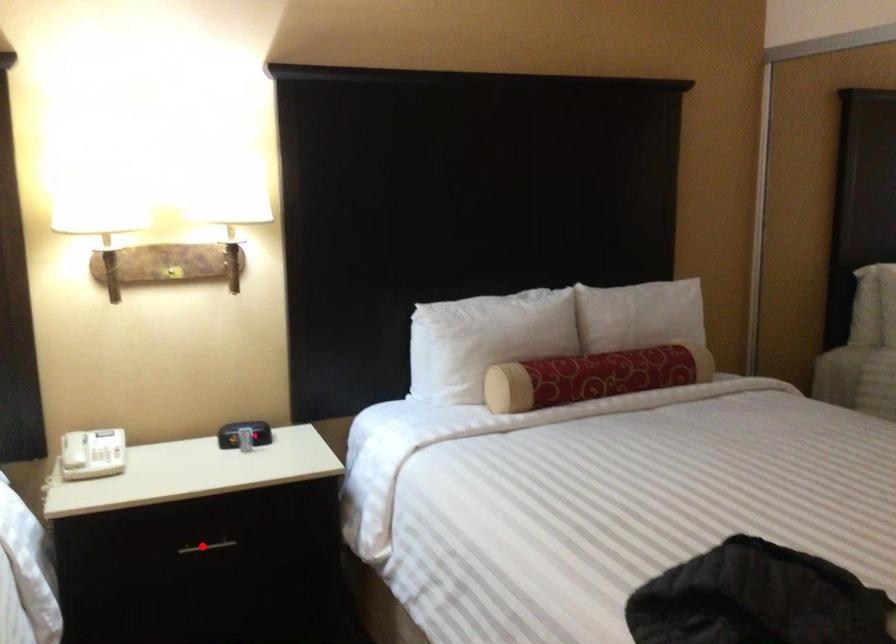
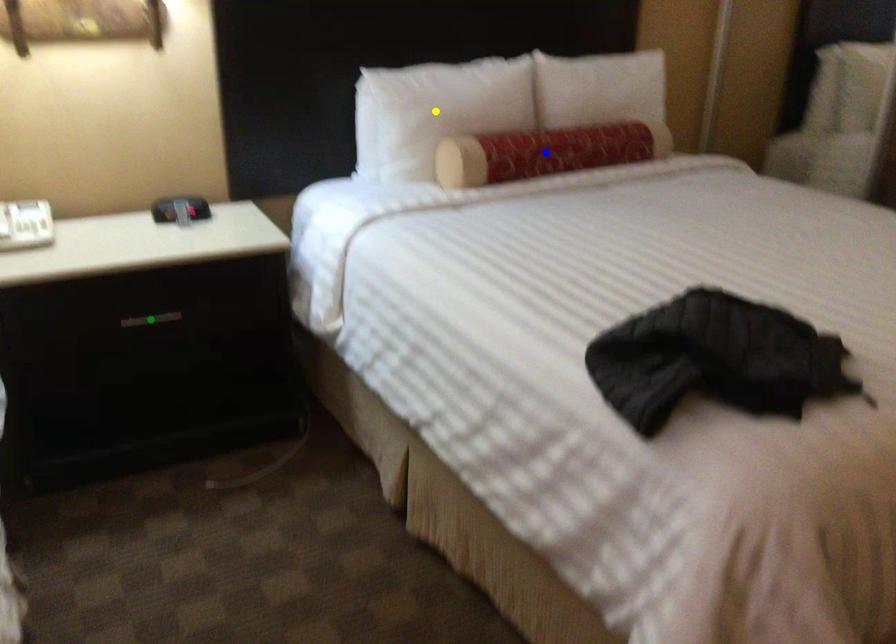
Question: I am providing you with two images of the same scene from different viewpoints. A red point is marked on the first image. You are given multiple points on the second image. Can you choose the point in image 2 that corresponds to the point in image 1?

Choices:
 (A) green point
 (B) blue point
 (C) yellow point

Answer: (A)